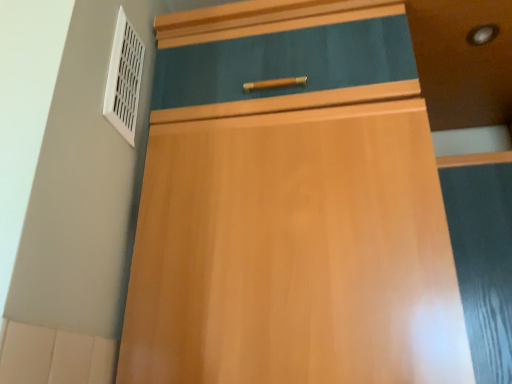
Question: Should I look upward or downward to see matte black screen door at right?

Choices:
 (A) up
 (B) down

Answer: (B)

Question: Does white plastic vent at upper left have a larger size compared to matte black screen door at right?

Choices:
 (A) no
 (B) yes

Answer: (A)

Question: Considering the relative sizes of white plastic vent at upper left and matte black screen door at right in the image provided, is white plastic vent at upper left wider than matte black screen door at right?

Choices:
 (A) yes
 (B) no

Answer: (B)

Question: Is matte black screen door at right a part of white plastic vent at upper left?

Choices:
 (A) yes
 (B) no

Answer: (B)

Question: Is white plastic vent at upper left far from matte black screen door at right?

Choices:
 (A) no
 (B) yes

Answer: (A)

Question: From a real-world perspective, is white plastic vent at upper left on matte black screen door at right?

Choices:
 (A) yes
 (B) no

Answer: (A)

Question: From the image's perspective, would you say white plastic vent at upper left is shown under matte black screen door at right?

Choices:
 (A) yes
 (B) no

Answer: (B)

Question: From the image's perspective, is matte black screen door at right beneath white plastic vent at upper left?

Choices:
 (A) yes
 (B) no

Answer: (A)

Question: Is matte black screen door at right facing away from white plastic vent at upper left?

Choices:
 (A) yes
 (B) no

Answer: (B)

Question: Is matte black screen door at right closer to camera compared to white plastic vent at upper left?

Choices:
 (A) yes
 (B) no

Answer: (A)

Question: Does matte black screen door at right appear on the right side of white plastic vent at upper left?

Choices:
 (A) no
 (B) yes

Answer: (B)

Question: Does matte black screen door at right come behind white plastic vent at upper left?

Choices:
 (A) yes
 (B) no

Answer: (B)

Question: Is white plastic vent at upper left a part of matte black screen door at right?

Choices:
 (A) no
 (B) yes

Answer: (A)

Question: From the image's perspective, is matte black screen door at right above or below white plastic vent at upper left?

Choices:
 (A) below
 (B) above

Answer: (A)